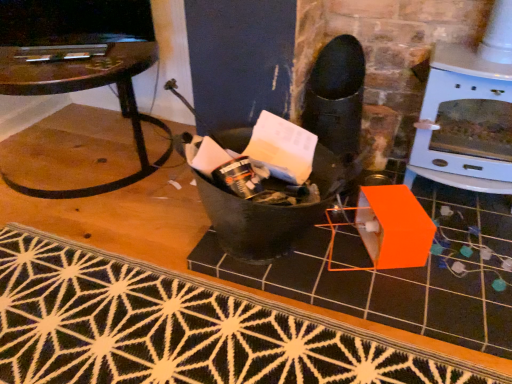
Question: Is black textured rug at lower center wider than white glossy fireplace at upper right?

Choices:
 (A) yes
 (B) no

Answer: (A)

Question: From the image's perspective, is black textured rug at lower center under white glossy fireplace at upper right?

Choices:
 (A) no
 (B) yes

Answer: (B)

Question: Is black textured rug at lower center shorter than white glossy fireplace at upper right?

Choices:
 (A) no
 (B) yes

Answer: (B)

Question: Can you confirm if black textured rug at lower center is taller than white glossy fireplace at upper right?

Choices:
 (A) yes
 (B) no

Answer: (B)

Question: Can you confirm if black textured rug at lower center is positioned to the right of white glossy fireplace at upper right?

Choices:
 (A) no
 (B) yes

Answer: (A)

Question: Can you confirm if black textured rug at lower center is smaller than white glossy fireplace at upper right?

Choices:
 (A) no
 (B) yes

Answer: (B)

Question: Is black matte tile at center thinner than clear glass table at left?

Choices:
 (A) no
 (B) yes

Answer: (A)

Question: Does black matte tile at center have a larger size compared to clear glass table at left?

Choices:
 (A) no
 (B) yes

Answer: (A)

Question: Is black matte tile at center aimed at clear glass table at left?

Choices:
 (A) yes
 (B) no

Answer: (B)

Question: Would you say black matte tile at center is outside clear glass table at left?

Choices:
 (A) yes
 (B) no

Answer: (A)

Question: Is black matte tile at center positioned behind clear glass table at left?

Choices:
 (A) yes
 (B) no

Answer: (B)

Question: From a real-world perspective, is black matte tile at center positioned under clear glass table at left based on gravity?

Choices:
 (A) yes
 (B) no

Answer: (A)

Question: From a real-world perspective, is clear glass table at left over black matte tile at center?

Choices:
 (A) yes
 (B) no

Answer: (A)